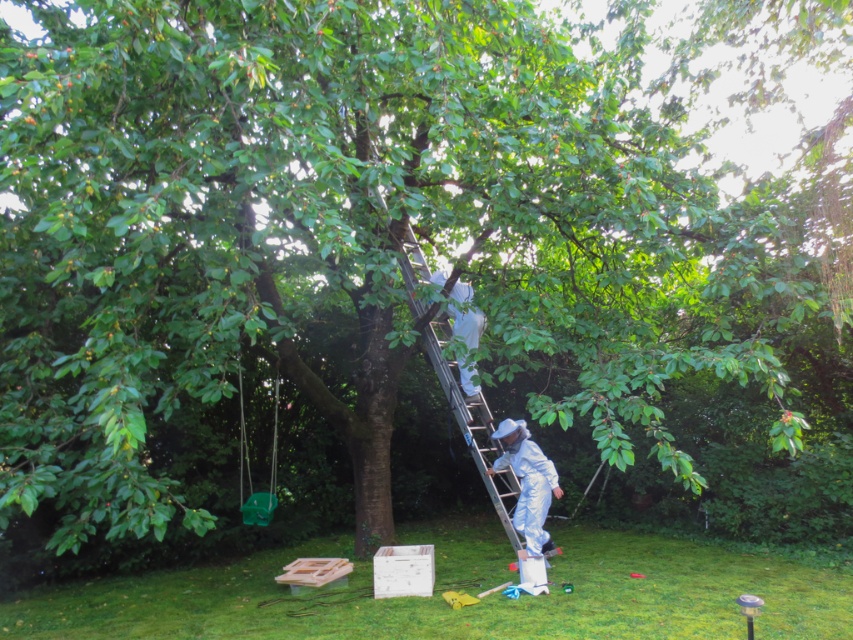
Is white fabric at upper center positioned at the back of green plastic swing at lower left?

No, white fabric at upper center is in front of green plastic swing at lower left.

Who is positioned more to the left, white fabric at upper center or green plastic swing at lower left?

Positioned to the left is green plastic swing at lower left.

Locate an element on the screen. white fabric at upper center is located at coordinates (466, 324).

Is point (486, 454) behind point (519, 483)?

Yes, it is behind point (519, 483).

What do you see at coordinates (473, 426) in the screenshot? The image size is (853, 640). I see `silver metallic ladder at center` at bounding box center [473, 426].

Where is `silver metallic ladder at center`? This screenshot has width=853, height=640. silver metallic ladder at center is located at coordinates (473, 426).

Is point (490, 416) closer to camera compared to point (274, 433)?

Yes, point (490, 416) is in front of point (274, 433).

Between silver metallic ladder at center and green plastic swing at lower left, which one has more height?

silver metallic ladder at center is taller.

Find the location of `silver metallic ladder at center`. silver metallic ladder at center is located at coordinates pyautogui.click(x=473, y=426).

Where is `silver metallic ladder at center`? silver metallic ladder at center is located at coordinates (473, 426).